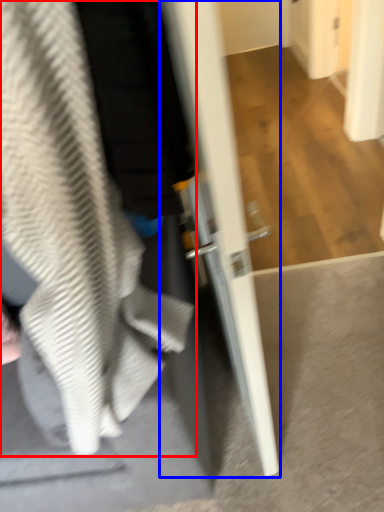
Question: Which of the following is the farthest to the observer, sweatshirt (highlighted by a red box) or door (highlighted by a blue box)?

Choices:
 (A) sweatshirt
 (B) door

Answer: (A)